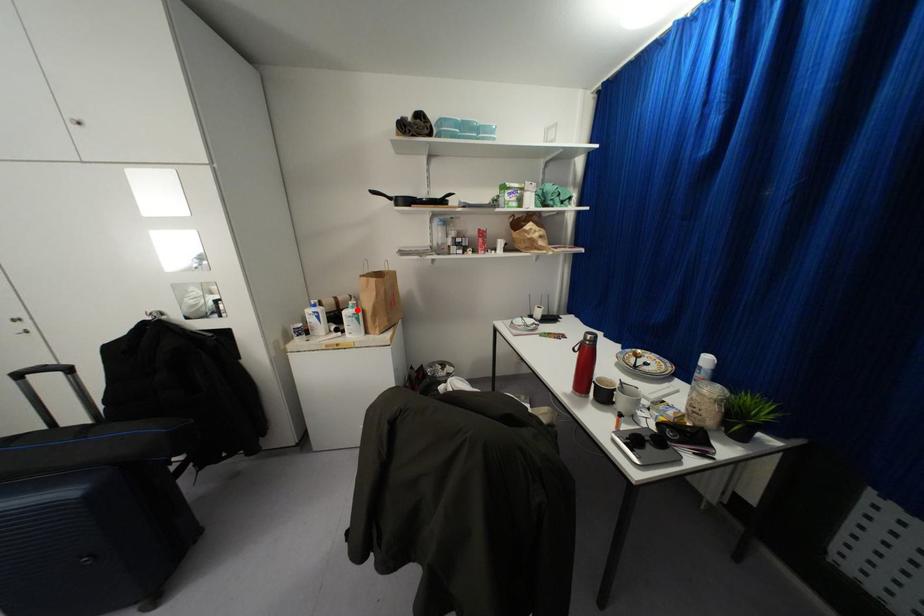
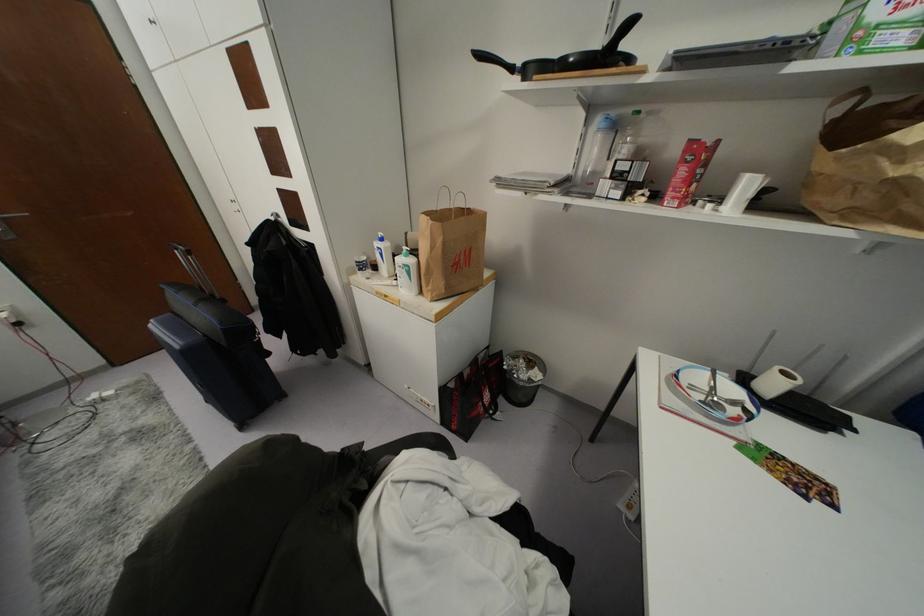
The point at the highlighted location is marked in the first image. Where is the corresponding point in the second image?

(410, 261)